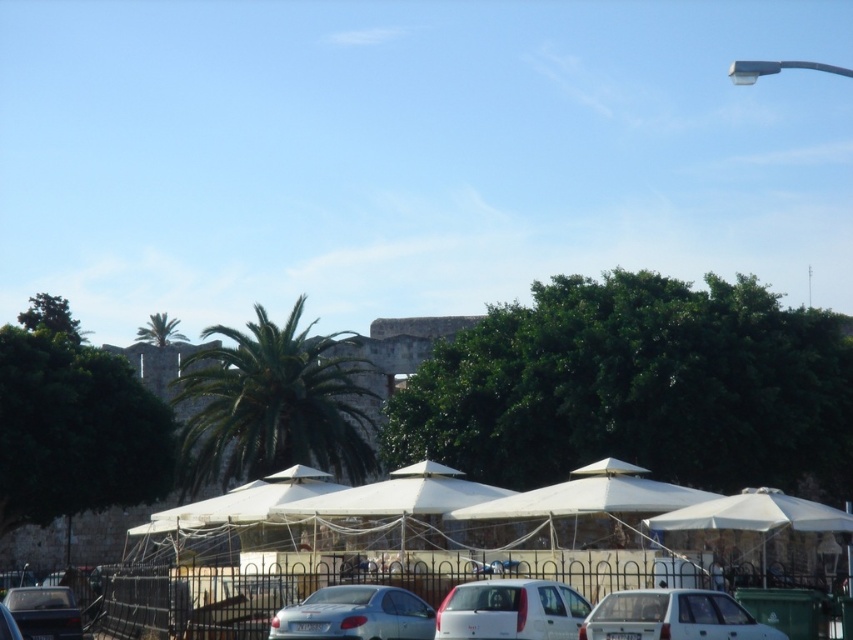
Question: Which of the following is the farthest from the observer?

Choices:
 (A) silver metallic car at lower right
 (B) matte gray car at lower left
 (C) white matte car at center

Answer: (B)

Question: Can you confirm if green leafy palm tree at center is wider than green leafy palm tree at upper left?

Choices:
 (A) no
 (B) yes

Answer: (A)

Question: Which of the following is the farthest from the observer?

Choices:
 (A) (547, 596)
 (B) (154, 321)
 (C) (54, 604)

Answer: (B)

Question: Can you confirm if silver metallic car at lower right is wider than matte gray car at lower left?

Choices:
 (A) yes
 (B) no

Answer: (A)

Question: Is satin silver car at center further to the viewer compared to matte gray car at lower left?

Choices:
 (A) yes
 (B) no

Answer: (B)

Question: Which point is farther from the camera taking this photo?

Choices:
 (A) (271, 336)
 (B) (61, 612)

Answer: (A)